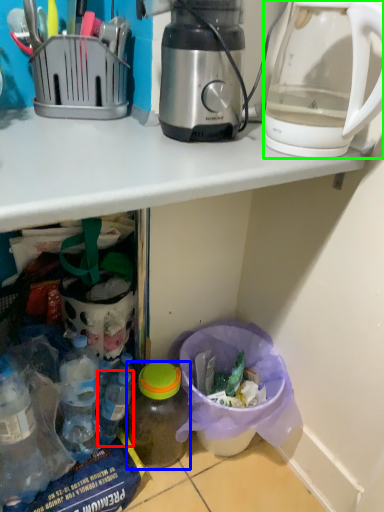
Question: Considering the real-world distances, which object is closest to bottle (highlighted by a red box)? bottle (highlighted by a blue box) or kettle (highlighted by a green box).

Choices:
 (A) bottle
 (B) kettle

Answer: (A)